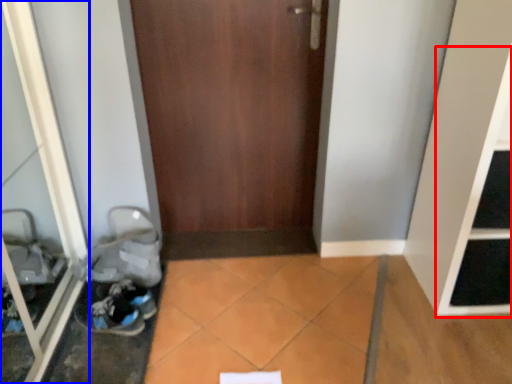
Question: Which object appears farthest to the camera in this image, shelf (highlighted by a red box) or glass door (highlighted by a blue box)?

Choices:
 (A) shelf
 (B) glass door

Answer: (A)